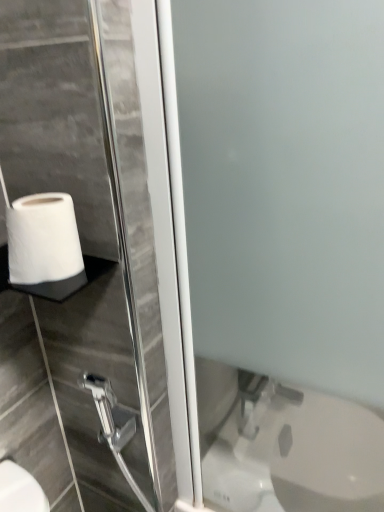
Question: Does metallic silver shower head at lower left have a larger size compared to white matte toilet paper at lower left?

Choices:
 (A) yes
 (B) no

Answer: (B)

Question: Can you confirm if metallic silver shower head at lower left is wider than white matte toilet paper at lower left?

Choices:
 (A) yes
 (B) no

Answer: (B)

Question: Does metallic silver shower head at lower left lie behind white matte toilet paper at lower left?

Choices:
 (A) yes
 (B) no

Answer: (A)

Question: From a real-world perspective, is metallic silver shower head at lower left positioned under white matte toilet paper at lower left based on gravity?

Choices:
 (A) no
 (B) yes

Answer: (B)

Question: Considering the relative positions of metallic silver shower head at lower left and white matte toilet paper at lower left in the image provided, is metallic silver shower head at lower left to the left of white matte toilet paper at lower left from the viewer's perspective?

Choices:
 (A) yes
 (B) no

Answer: (B)

Question: Does point (183, 44) appear closer or farther from the camera than point (102, 396)?

Choices:
 (A) closer
 (B) farther

Answer: (A)

Question: Is frosted glass screen door at center inside or outside of metallic silver shower head at lower left?

Choices:
 (A) inside
 (B) outside

Answer: (B)

Question: Is frosted glass screen door at center bigger or smaller than metallic silver shower head at lower left?

Choices:
 (A) small
 (B) big

Answer: (B)

Question: Considering the positions of frosted glass screen door at center and metallic silver shower head at lower left in the image, is frosted glass screen door at center taller or shorter than metallic silver shower head at lower left?

Choices:
 (A) tall
 (B) short

Answer: (A)

Question: From their relative heights in the image, would you say metallic silver shower head at lower left is taller or shorter than white matte toilet paper at lower left?

Choices:
 (A) short
 (B) tall

Answer: (A)

Question: Looking at their shapes, would you say metallic silver shower head at lower left is wider or thinner than white matte toilet paper at lower left?

Choices:
 (A) wide
 (B) thin

Answer: (B)

Question: From the image's perspective, is metallic silver shower head at lower left located above or below white matte toilet paper at lower left?

Choices:
 (A) below
 (B) above

Answer: (A)

Question: From a real-world perspective, is metallic silver shower head at lower left physically located above or below white matte toilet paper at lower left?

Choices:
 (A) above
 (B) below

Answer: (B)

Question: Would you say white matte toilet paper at lower left is to the left or to the right of frosted glass screen door at center in the picture?

Choices:
 (A) left
 (B) right

Answer: (A)

Question: Considering the positions of white matte toilet paper at lower left and frosted glass screen door at center in the image, is white matte toilet paper at lower left taller or shorter than frosted glass screen door at center?

Choices:
 (A) short
 (B) tall

Answer: (A)